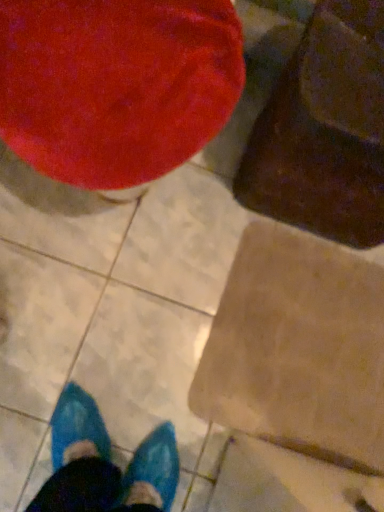
The width and height of the screenshot is (384, 512). In order to click on blank space to the left of brown cardboard at lower right in this screenshot , I will do `click(154, 271)`.